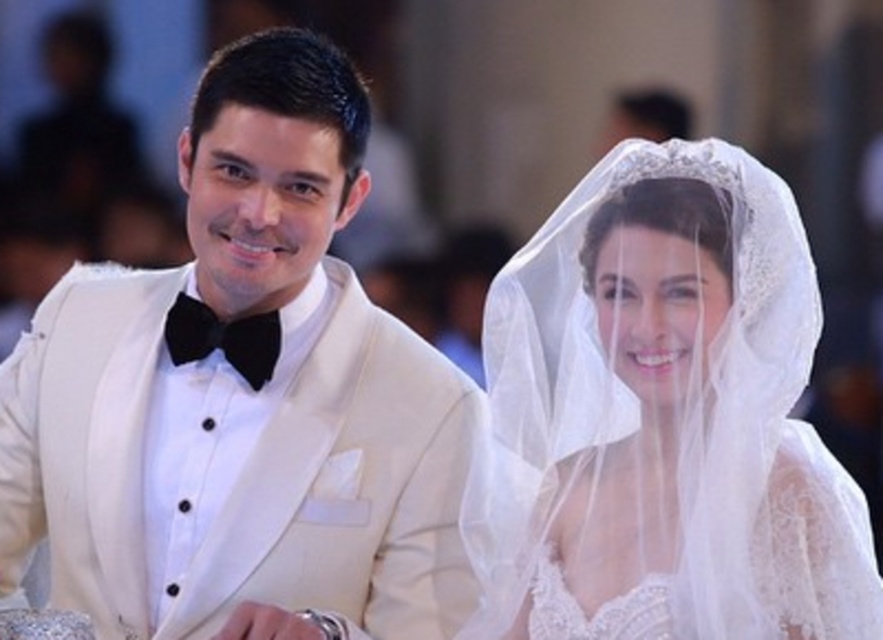
Question: Is matte white suit at left thinner than white lace veil at upper right?

Choices:
 (A) yes
 (B) no

Answer: (B)

Question: Which object is farther from the camera taking this photo?

Choices:
 (A) matte white suit at left
 (B) white lace veil at upper right

Answer: (A)

Question: Is matte white suit at left positioned before white lace veil at upper right?

Choices:
 (A) yes
 (B) no

Answer: (B)

Question: Among these points, which one is farthest from the camera?

Choices:
 (A) (745, 388)
 (B) (297, 435)

Answer: (B)

Question: Does matte white suit at left have a lesser width compared to white lace veil at upper right?

Choices:
 (A) yes
 (B) no

Answer: (B)

Question: Which point is closer to the camera taking this photo?

Choices:
 (A) (331, 346)
 (B) (758, 195)

Answer: (B)